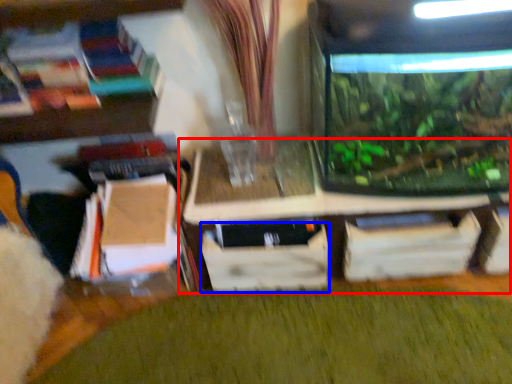
Question: Which object appears farthest to the camera in this image, table (highlighted by a red box) or drawer (highlighted by a blue box)?

Choices:
 (A) table
 (B) drawer

Answer: (B)